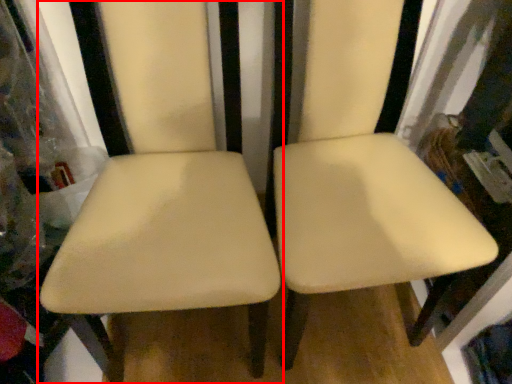
Question: From the image's perspective, considering the relative positions of chair (annotated by the red box) and chair in the image provided, where is chair (annotated by the red box) located with respect to the staircase?

Choices:
 (A) below
 (B) above

Answer: (A)